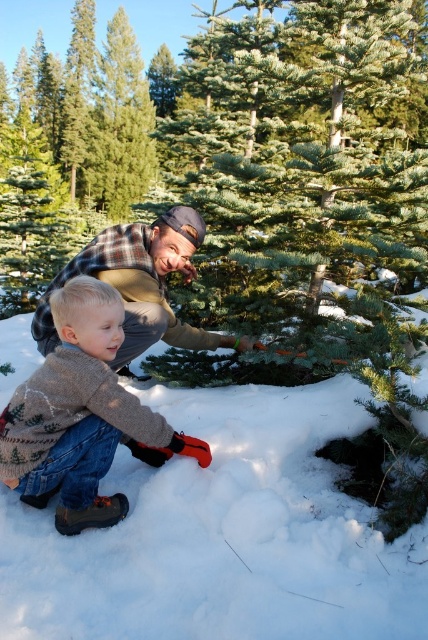
Question: Can you confirm if knitted sweater at lower left is thinner than plaid flannel shirt at center?

Choices:
 (A) no
 (B) yes

Answer: (B)

Question: Is the position of green matte christmas tree at center less distant than that of knitted sweater at lower left?

Choices:
 (A) no
 (B) yes

Answer: (A)

Question: Is green matte christmas tree at center below plaid flannel shirt at center?

Choices:
 (A) yes
 (B) no

Answer: (B)

Question: Which point appears closest to the camera in this image?

Choices:
 (A) (112, 348)
 (B) (345, 356)

Answer: (A)

Question: Which point is farther to the camera?

Choices:
 (A) (89, 454)
 (B) (136, 256)

Answer: (B)

Question: Among these points, which one is nearest to the camera?

Choices:
 (A) (276, 259)
 (B) (190, 209)
 (C) (41, 476)

Answer: (C)